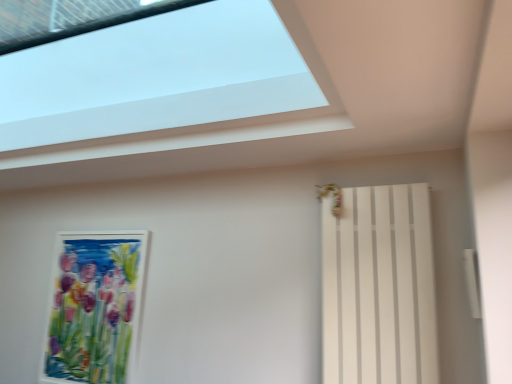
Describe the element at coordinates (155, 76) in the screenshot. The image size is (512, 384). I see `transparent glass window at upper center` at that location.

The image size is (512, 384). What are the coordinates of `transparent glass window at upper center` in the screenshot? It's located at (155, 76).

Does watercolor paper painting at left have a greater width compared to transparent glass window at upper center?

No, watercolor paper painting at left is not wider than transparent glass window at upper center.

Is watercolor paper painting at left in front of or behind transparent glass window at upper center in the image?

watercolor paper painting at left is positioned farther from the viewer than transparent glass window at upper center.

Considering the relative sizes of watercolor paper painting at left and transparent glass window at upper center in the image provided, is watercolor paper painting at left smaller than transparent glass window at upper center?

Yes.

Find the location of a particular element. shutter beneath the transparent glass window at upper center (from a real-world perspective) is located at coordinates (379, 287).

From a real-world perspective, is white matte radiator at right positioned above or below transparent glass window at upper center?

white matte radiator at right is situated lower than transparent glass window at upper center in the real world.

How many degrees apart are the facing directions of white matte radiator at right and transparent glass window at upper center?

white matte radiator at right and transparent glass window at upper center are facing 2.51 degrees away from each other.

From the image's perspective, which is above, white matte radiator at right or transparent glass window at upper center?

transparent glass window at upper center is shown above in the image.

Is watercolor paper painting at left oriented away from white matte radiator at right?

watercolor paper painting at left is not turned away from white matte radiator at right.

Is watercolor paper painting at left to the left of white matte radiator at right from the viewer's perspective?

Yes.

Between watercolor paper painting at left and white matte radiator at right, which one has less height?

white matte radiator at right.

Which point is more forward, (76, 340) or (337, 329)?

The point (337, 329) is closer to the camera.

How many degrees apart are the facing directions of transparent glass window at upper center and white matte radiator at right?

2.51 degrees separate the facing orientations of transparent glass window at upper center and white matte radiator at right.

Which object is further away from the camera taking this photo, transparent glass window at upper center or white matte radiator at right?

Positioned behind is white matte radiator at right.

From a real-world perspective, who is located higher, transparent glass window at upper center or white matte radiator at right?

transparent glass window at upper center is physically above.

Which is behind, point (214, 13) or point (432, 250)?

The point (214, 13) is farther from the camera.

Is point (49, 123) closer to camera compared to point (125, 344)?

That is True.

What's the angular difference between transparent glass window at upper center and watercolor paper painting at left's facing directions?

They differ by 89.1 degrees in their facing directions.

Which of these two, transparent glass window at upper center or watercolor paper painting at left, stands taller?

watercolor paper painting at left.

Is transparent glass window at upper center facing towards watercolor paper painting at left?

No, transparent glass window at upper center is not turned towards watercolor paper painting at left.

Who is bigger, white matte radiator at right or watercolor paper painting at left?

white matte radiator at right.

Is white matte radiator at right wider than watercolor paper painting at left?

Yes.

Is white matte radiator at right facing away from watercolor paper painting at left?

No, watercolor paper painting at left is not at the back of white matte radiator at right.

From their relative heights in the image, would you say white matte radiator at right is taller or shorter than watercolor paper painting at left?

white matte radiator at right is shorter than watercolor paper painting at left.

Locate an element on the screen. This screenshot has height=384, width=512. window above the watercolor paper painting at left (from the image's perspective) is located at coordinates (155, 76).

You are a GUI agent. You are given a task and a screenshot of the screen. Output one action in this format:
    pyautogui.click(x=<x>, y=<y>)
    Task: Click on the shutter below the transparent glass window at upper center (from the image's perspective)
    
    Given the screenshot: What is the action you would take?
    pyautogui.click(x=379, y=287)

Considering their positions, is white matte radiator at right positioned closer to watercolor paper painting at left than transparent glass window at upper center?

Among the two, transparent glass window at upper center is located nearer to watercolor paper painting at left.

Which object lies further to the anchor point transparent glass window at upper center, white matte radiator at right or watercolor paper painting at left?

white matte radiator at right is further to transparent glass window at upper center.

Estimate the real-world distances between objects in this image. Which object is further from transparent glass window at upper center, watercolor paper painting at left or white matte radiator at right?

white matte radiator at right lies further to transparent glass window at upper center than the other object.

Looking at the image, which one is located closer to white matte radiator at right, watercolor paper painting at left or transparent glass window at upper center?

The object closer to white matte radiator at right is transparent glass window at upper center.

When comparing their distances from watercolor paper painting at left, does transparent glass window at upper center or white matte radiator at right seem further?

white matte radiator at right lies further to watercolor paper painting at left than the other object.

Looking at the image, which one is located further to white matte radiator at right, transparent glass window at upper center or watercolor paper painting at left?

watercolor paper painting at left lies further to white matte radiator at right than the other object.

Image resolution: width=512 pixels, height=384 pixels. Identify the location of shutter between transparent glass window at upper center and watercolor paper painting at left along the z-axis. (379, 287).